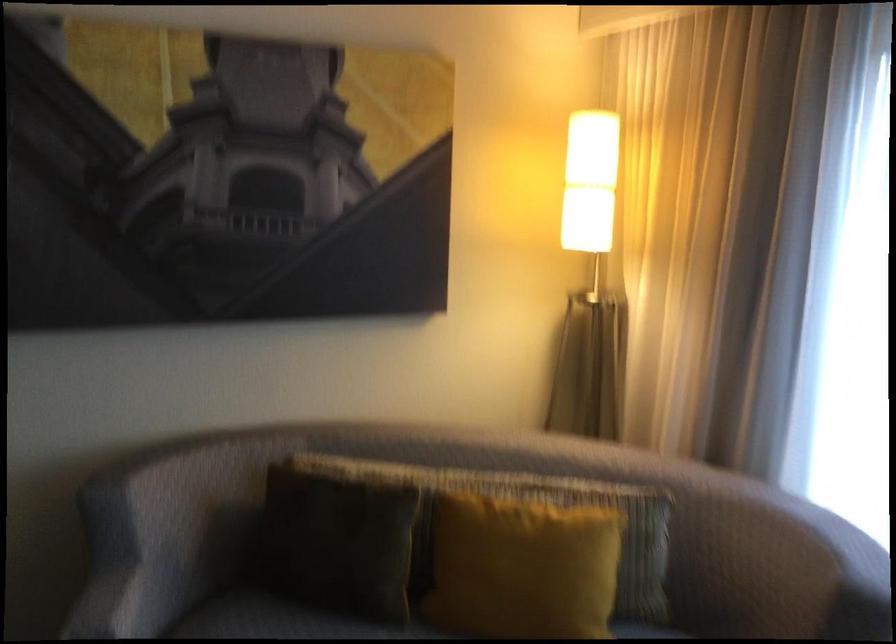
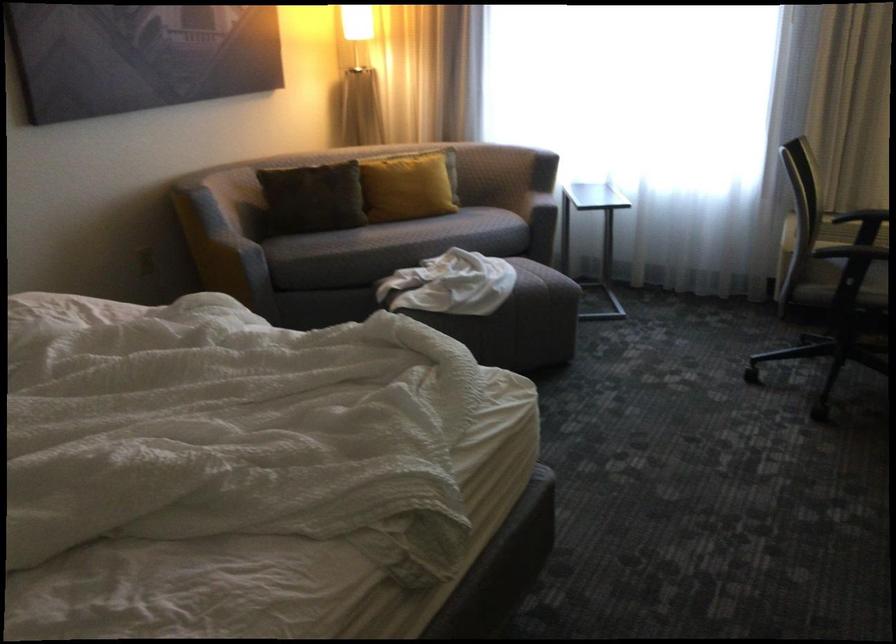
The point at [306,556] is marked in the first image. Where is the corresponding point in the second image?

(314, 196)